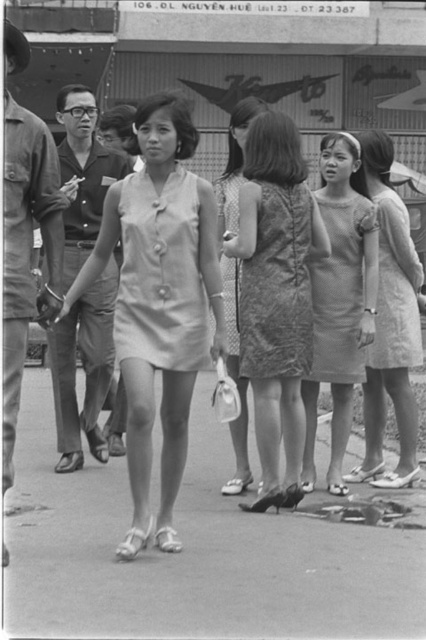
You are a photographer standing on the street and want to take a picture of the light beige fabric dress at right without including the smooth concrete pavement at center in the frame. Is this possible given their positions?

The smooth concrete pavement at center is in front of the light beige fabric dress at right, so the dress is behind the pavement. To avoid including the pavement in the frame, you would need to position yourself or adjust your angle so that the dress is not obscured by the pavement. However, since the pavement is in front, it might block the view of the dress unless you move around it or lower your camera angle.